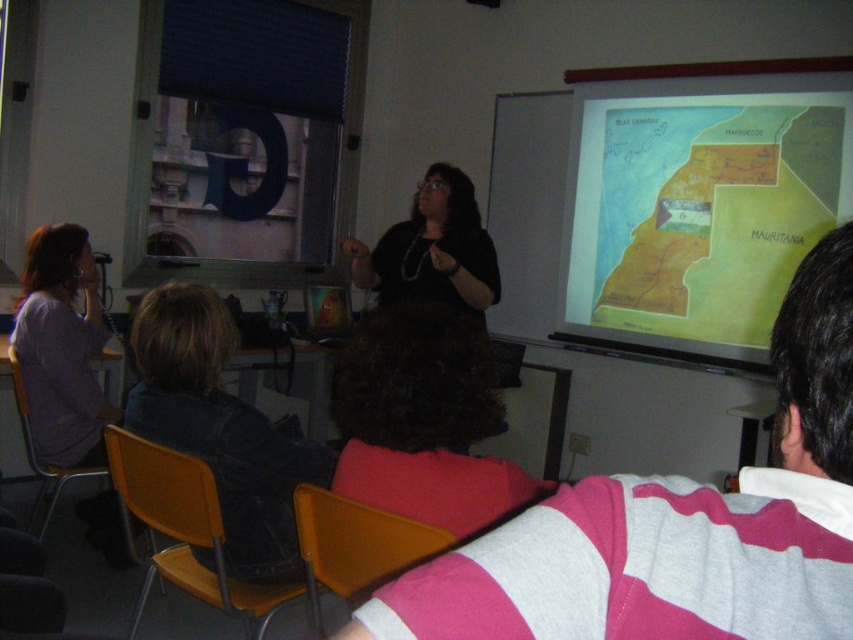
You are a student sitting at the back of the classroom. You notice two items in the scene described in the image. One is the striped cotton shirt at center and the other is the yellow paper map at upper right. Which of these two items appears smaller in size?

The striped cotton shirt at center appears smaller in size compared to the yellow paper map at upper right according to the description provided.

You are a student who needs to pass a notebook to a classmate sitting between the striped cotton shirt at center and the dark blue jacket at lower left. Can you do so without moving from your seat?

The striped cotton shirt at center and the dark blue jacket at lower left are 4.80 feet apart. Since the distance between them is more than 4.80 feet, you can pass the notebook without moving from your seat.

From the picture: You are attending a presentation in a classroom and notice two items of interest. The striped cotton shirt at center is worn by the presenter, and the yellow paper map at upper right is displayed on the screen. Based on their sizes, which item would you estimate to be wider?

The yellow paper map at upper right is wider than the striped cotton shirt at center because the striped cotton shirt at center has a lesser width compared to yellow paper map at upper right.